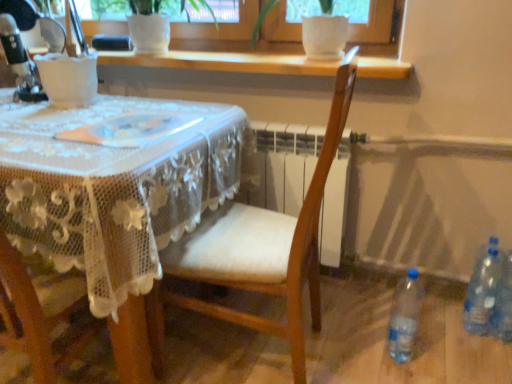
Identify the location of free spot to the left of clear plastic bottle at lower right, the third bottle when ordered from left to right. (456, 346).